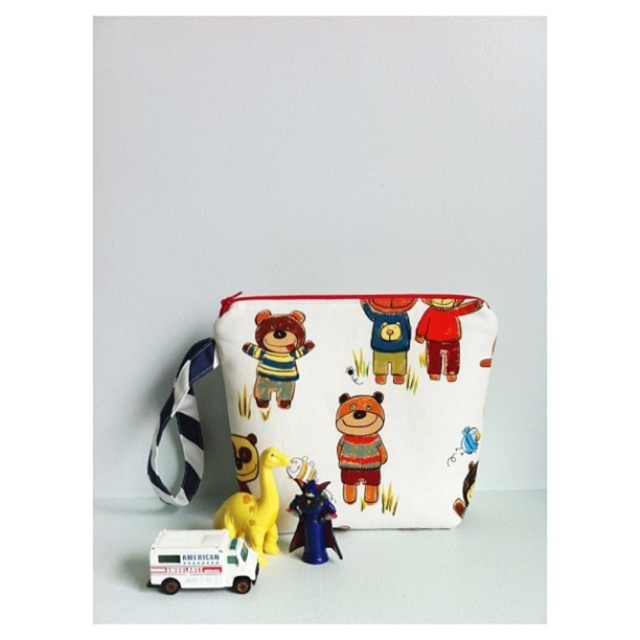
Question: Is white plastic toy car at lower left closer to camera compared to red fabric teddy bear at center?

Choices:
 (A) yes
 (B) no

Answer: (A)

Question: From the image, what is the correct spatial relationship of white fabric pouch at center in relation to metallic blue figurine at lower center?

Choices:
 (A) below
 (B) above

Answer: (B)

Question: Which point is farther to the camera?

Choices:
 (A) (426, 353)
 (B) (358, 465)
 (C) (394, 323)

Answer: (B)

Question: Considering the real-world distances, which object is closest to the white plastic toy car at lower left?

Choices:
 (A) fluffy brown bear at center
 (B) soft plush bear at center

Answer: (A)

Question: Is soft plush bear at center positioned at the back of metallic blue figurine at lower center?

Choices:
 (A) yes
 (B) no

Answer: (A)

Question: Which object is closer to the camera taking this photo?

Choices:
 (A) white plastic toy car at lower left
 (B) yellow rubber dinosaur at lower center
 (C) white fabric pouch at center
 (D) fluffy brown bear at center

Answer: (A)